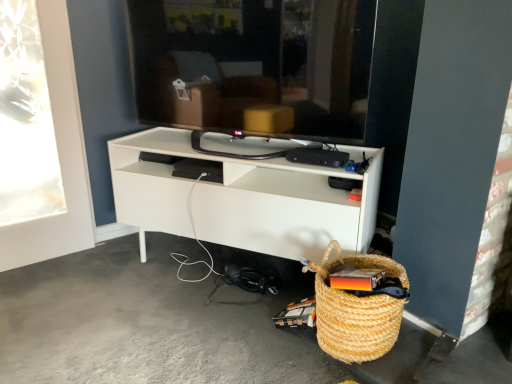
Question: Based on their positions, is black glossy tv at center located to the left or right of woven straw basket at lower right?

Choices:
 (A) right
 (B) left

Answer: (B)

Question: From a real-world perspective, is black glossy tv at center physically located above or below woven straw basket at lower right?

Choices:
 (A) above
 (B) below

Answer: (A)

Question: Based on their relative distances, which object is farther from the gray concrete floor at lower left?

Choices:
 (A) white matte shelf at center
 (B) woven straw basket at lower right
 (C) black glossy tv at center

Answer: (C)

Question: Considering the real-world distances, which object is farthest from the white matte shelf at center?

Choices:
 (A) black glossy tv at center
 (B) woven straw basket at lower right
 (C) gray concrete floor at lower left

Answer: (C)